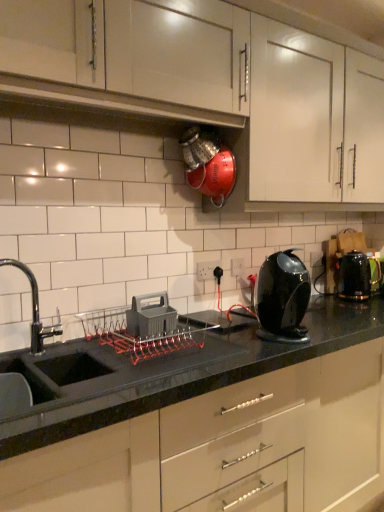
Question: In which direction should I rotate to look at black glossy countertop at center, marked as the first cabinetry in a bottom-to-top arrangement?

Choices:
 (A) left
 (B) right

Answer: (B)

Question: Considering the relative positions of black glossy kettle at right and black plastic electric outlet at center, which is counted as the first electric outlet, starting from the right, in the image provided, is black glossy kettle at right to the left of black plastic electric outlet at center, which is counted as the first electric outlet, starting from the right, from the viewer's perspective?

Choices:
 (A) no
 (B) yes

Answer: (A)

Question: Is black glossy kettle at right with black plastic electric outlet at center, which is counted as the first electric outlet, starting from the right?

Choices:
 (A) yes
 (B) no

Answer: (B)

Question: Is black plastic electric outlet at center, which ranks as the 2th electric outlet in front-to-back order, at the back of black glossy kettle at right?

Choices:
 (A) yes
 (B) no

Answer: (B)

Question: Is black glossy kettle at right outside black plastic electric outlet at center, which is counted as the first electric outlet, starting from the right?

Choices:
 (A) no
 (B) yes

Answer: (B)

Question: Considering the relative sizes of black glossy kettle at right and black plastic electric outlet at center, acting as the 2th electric outlet starting from the left, in the image provided, is black glossy kettle at right bigger than black plastic electric outlet at center, acting as the 2th electric outlet starting from the left,?

Choices:
 (A) yes
 (B) no

Answer: (A)

Question: Does black glossy kettle at right have a greater width compared to black plastic electric outlet at center, which ranks as the 2th electric outlet in front-to-back order?

Choices:
 (A) yes
 (B) no

Answer: (A)

Question: Is white plastic electric outlet at center, the 1th electric outlet viewed from the front, facing towards white matte cabinet at upper center, marked as the 2th cabinetry in a bottom-to-top arrangement?

Choices:
 (A) no
 (B) yes

Answer: (A)

Question: From the image's perspective, is white plastic electric outlet at center, which is counted as the first electric outlet, starting from the left, below white matte cabinet at upper center, the second cabinetry positioned from the top?

Choices:
 (A) no
 (B) yes

Answer: (B)

Question: Does white plastic electric outlet at center, which is counted as the first electric outlet, starting from the left, appear on the right side of white matte cabinet at upper center, marked as the 2th cabinetry in a bottom-to-top arrangement?

Choices:
 (A) yes
 (B) no

Answer: (B)

Question: From the image's perspective, is white plastic electric outlet at center, marked as the second electric outlet in a back-to-front arrangement, over white matte cabinet at upper center, the second cabinetry positioned from the top?

Choices:
 (A) no
 (B) yes

Answer: (A)

Question: Does white plastic electric outlet at center, marked as the second electric outlet in a back-to-front arrangement, have a greater width compared to white matte cabinet at upper center, the second cabinetry positioned from the top?

Choices:
 (A) no
 (B) yes

Answer: (A)

Question: Is white plastic electric outlet at center, which is counted as the first electric outlet, starting from the left, shorter than white matte cabinet at upper center, marked as the 2th cabinetry in a bottom-to-top arrangement?

Choices:
 (A) yes
 (B) no

Answer: (A)

Question: From the image's perspective, is black glossy kettle at right on top of white glossy cabinet at upper center, the 3th cabinetry from the bottom?

Choices:
 (A) no
 (B) yes

Answer: (A)